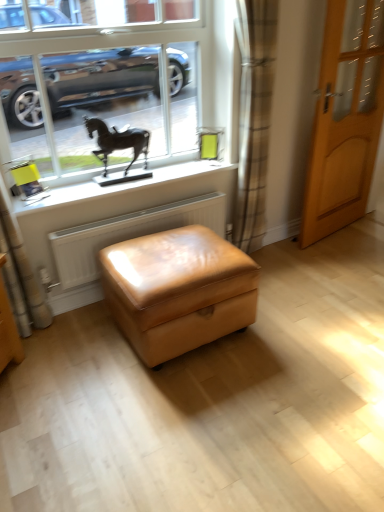
Question: From the image's perspective, is white textured radiator at lower center above white matte window sill at upper center?

Choices:
 (A) yes
 (B) no

Answer: (B)

Question: Is white matte window sill at upper center inside white textured radiator at lower center?

Choices:
 (A) no
 (B) yes

Answer: (A)

Question: From a real-world perspective, is white textured radiator at lower center on top of white matte window sill at upper center?

Choices:
 (A) yes
 (B) no

Answer: (B)

Question: Is white textured radiator at lower center at the right side of white matte window sill at upper center?

Choices:
 (A) no
 (B) yes

Answer: (B)

Question: Considering the relative sizes of white textured radiator at lower center and white matte window sill at upper center in the image provided, is white textured radiator at lower center smaller than white matte window sill at upper center?

Choices:
 (A) no
 (B) yes

Answer: (A)

Question: Is white textured radiator at lower center closer to the viewer compared to white matte window sill at upper center?

Choices:
 (A) yes
 (B) no

Answer: (B)

Question: Is white matte window sill at upper center located within light brown wooden door at right?

Choices:
 (A) yes
 (B) no

Answer: (B)

Question: Can you confirm if light brown wooden door at right is positioned to the left of white matte window sill at upper center?

Choices:
 (A) yes
 (B) no

Answer: (B)

Question: Is light brown wooden door at right oriented towards white matte window sill at upper center?

Choices:
 (A) yes
 (B) no

Answer: (B)

Question: From the image's perspective, is light brown wooden door at right located beneath white matte window sill at upper center?

Choices:
 (A) yes
 (B) no

Answer: (B)

Question: Is the depth of light brown wooden door at right less than that of white matte window sill at upper center?

Choices:
 (A) no
 (B) yes

Answer: (A)

Question: From a real-world perspective, is light brown wooden door at right located higher than white matte window sill at upper center?

Choices:
 (A) no
 (B) yes

Answer: (B)

Question: Is the position of light brown wooden door at right less distant than that of plaid fabric curtain at center?

Choices:
 (A) no
 (B) yes

Answer: (A)